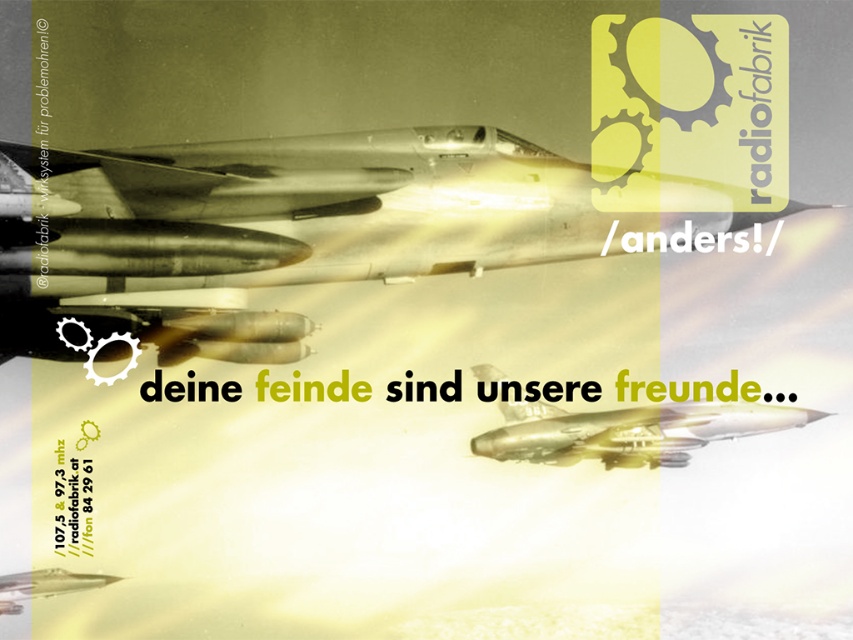
Question: Which object appears closest to the camera in this image?

Choices:
 (A) metallic silver plane at center
 (B) metallic gold airplane at center

Answer: (A)

Question: Is metallic silver plane at center below metallic gold airplane at center?

Choices:
 (A) yes
 (B) no

Answer: (B)

Question: Does metallic silver plane at center have a smaller size compared to metallic gold airplane at center?

Choices:
 (A) yes
 (B) no

Answer: (B)

Question: Does metallic silver plane at center appear on the left side of metallic gold airplane at center?

Choices:
 (A) no
 (B) yes

Answer: (B)

Question: Which object is farther from the camera taking this photo?

Choices:
 (A) metallic gold airplane at center
 (B) metallic silver plane at center

Answer: (A)

Question: Which object appears farthest from the camera in this image?

Choices:
 (A) metallic silver plane at center
 (B) metallic gold airplane at center

Answer: (B)